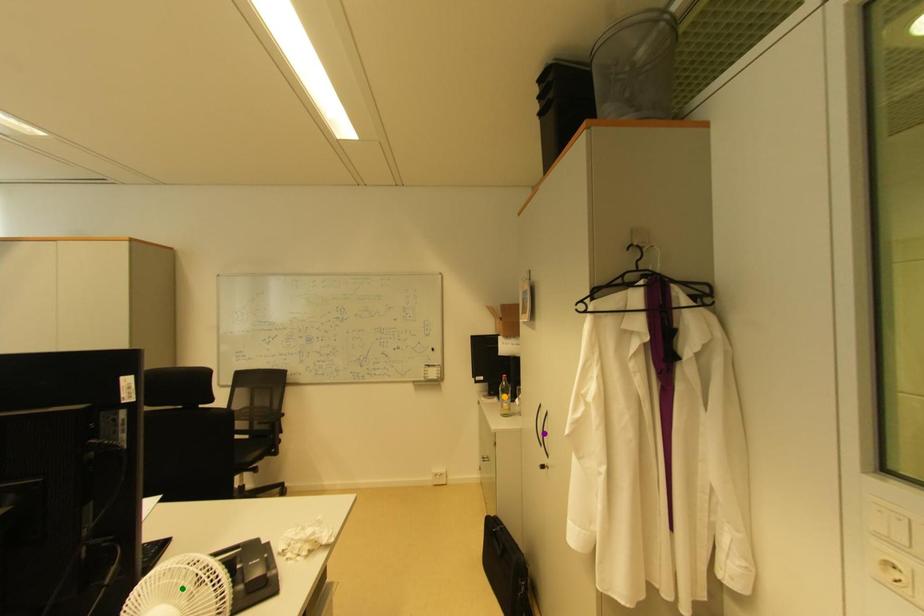
Order these from nearest to farthest:
A) purple point
B) orange point
C) green point

green point, purple point, orange point